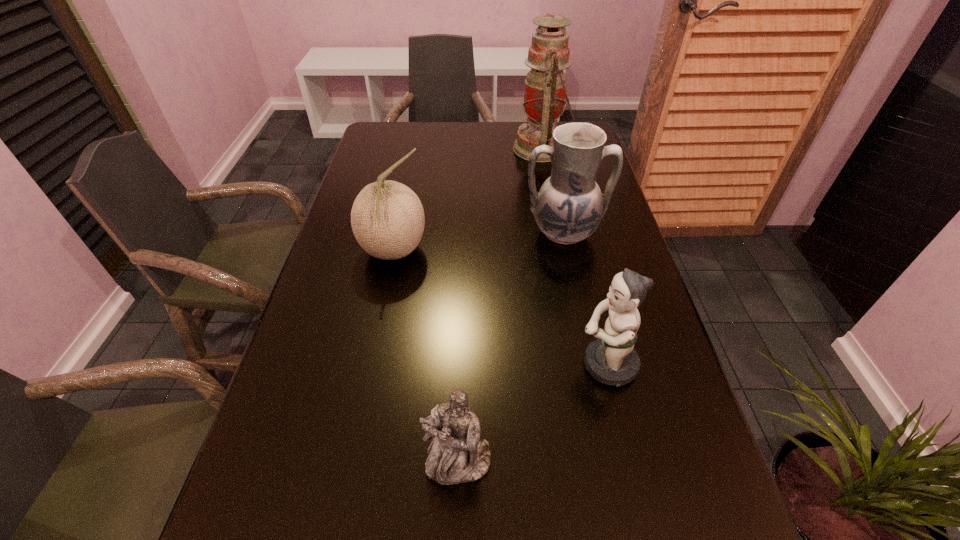
Identify the location of free space between the pitcher and the fourth farthest object. This screenshot has height=540, width=960. (585, 299).

The width and height of the screenshot is (960, 540). In order to click on free spot between the tallest object and the shorter figurine in this screenshot , I will do `click(500, 306)`.

You are a GUI agent. You are given a task and a screenshot of the screen. Output one action in this format:
    pyautogui.click(x=<x>, y=<y>)
    Task: Click on the free space that is in between the farthest object and the fourth farthest object
    
    Given the screenshot: What is the action you would take?
    pyautogui.click(x=574, y=256)

This screenshot has width=960, height=540. I want to click on vacant space that's between the fourth object from right to left and the farthest object, so click(500, 306).

Where is `object that stands as the fourth closest to the tallest object`? The width and height of the screenshot is (960, 540). object that stands as the fourth closest to the tallest object is located at coordinates (456, 455).

This screenshot has width=960, height=540. I want to click on the closest object to the pitcher, so click(545, 91).

Find the location of `free space that satisfies the following two spatial constraints: 1. on the front-facing side of the taller figurine; 2. on the front-facing side of the shortest object`. free space that satisfies the following two spatial constraints: 1. on the front-facing side of the taller figurine; 2. on the front-facing side of the shortest object is located at coordinates (630, 463).